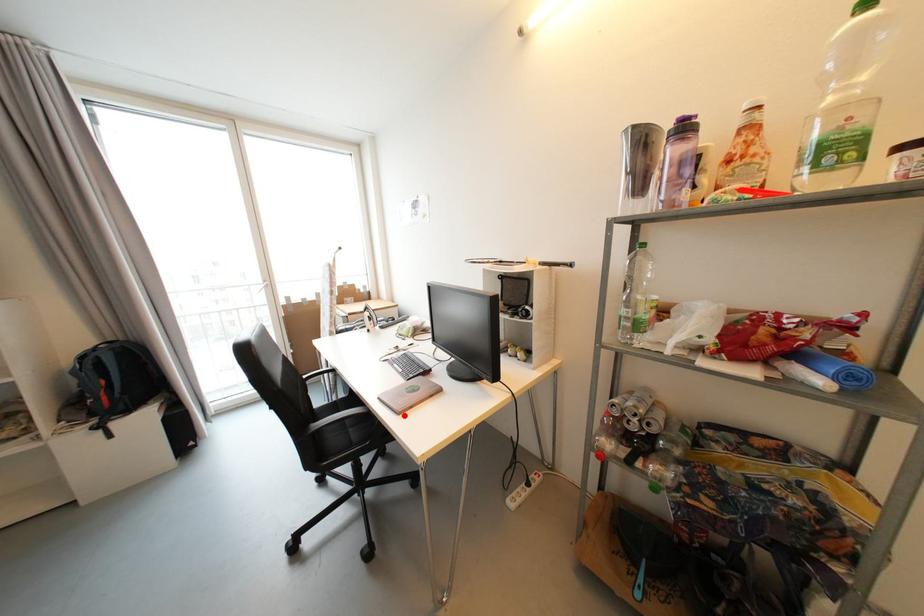
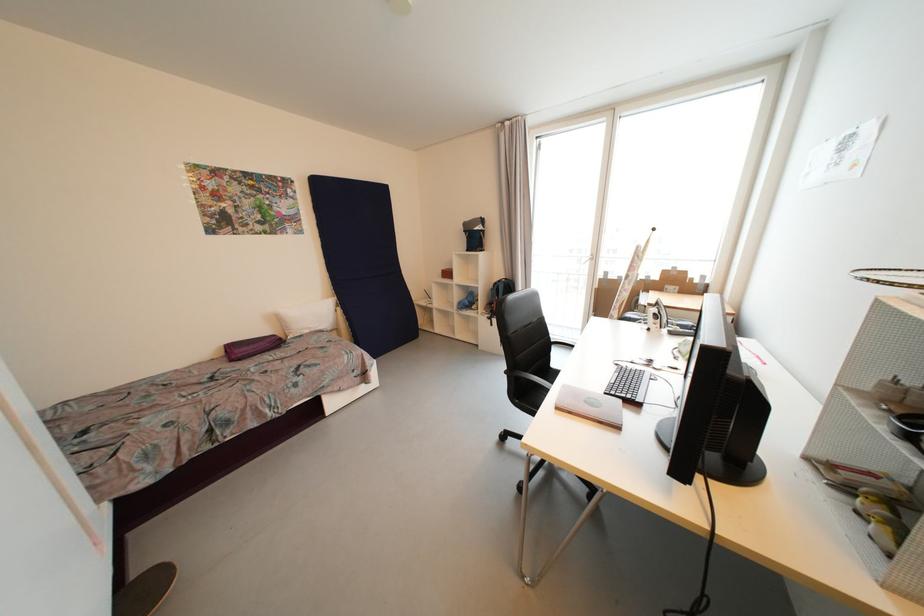
In the second image, find the point that corresponds to the highlighted location in the first image.

(562, 410)